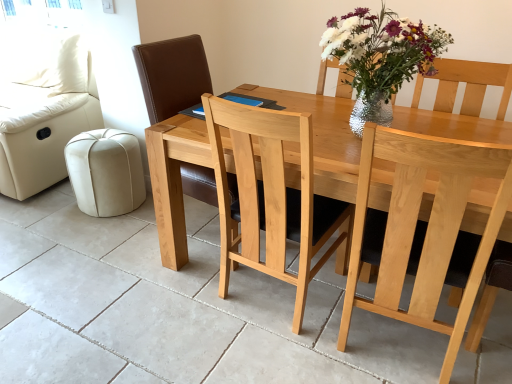
Find the location of a particular element. free space to the left of natural wood chair at center, which appears as the second chair when viewed from the right is located at coordinates (120, 254).